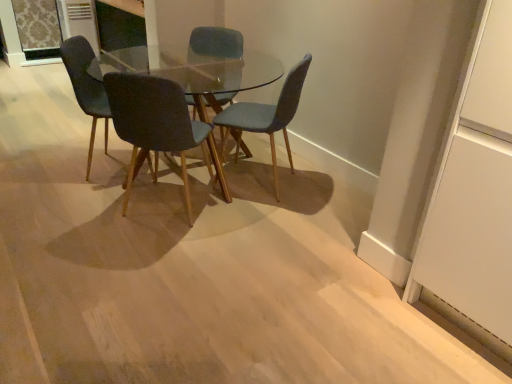
Question: Based on their sizes in the image, would you say dark gray fabric chair at center, the 2th chair positioned from the left, is bigger or smaller than matte blue chair at center, placed as the third chair when sorted from left to right?

Choices:
 (A) big
 (B) small

Answer: (B)

Question: In terms of height, does dark gray fabric chair at center, the 2th chair positioned from the left, look taller or shorter compared to matte blue chair at center, the 2th chair positioned from the right?

Choices:
 (A) short
 (B) tall

Answer: (A)

Question: Considering the real-world distances, which object is farthest from the textured blue chair at center, arranged as the 1th chair when viewed from the right?

Choices:
 (A) transparent glass table at center
 (B) matte blue chair at center, which is the first chair in left-to-right order
 (C) matte blue chair at center, the 2th chair positioned from the right
 (D) transparent glass door at upper right
 (E) dark gray fabric chair at center, which appears as the third chair when viewed from the right

Answer: (A)

Question: Considering the real-world distances, which object is closest to the textured blue chair at center, acting as the fourth chair starting from the left?

Choices:
 (A) matte blue chair at center, the 2th chair positioned from the right
 (B) dark gray fabric chair at center, which appears as the third chair when viewed from the right
 (C) transparent glass table at center
 (D) matte blue chair at center, positioned as the fourth chair in right-to-left order
 (E) transparent glass door at upper right

Answer: (B)